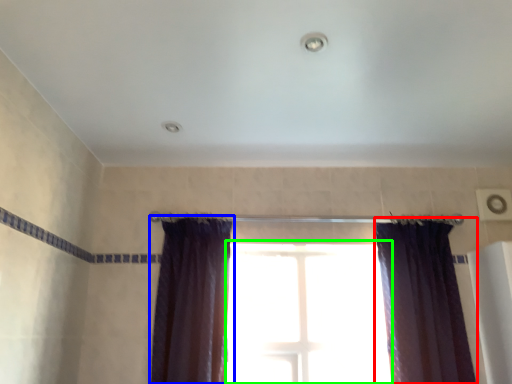
Question: Which object is positioned farthest from curtain (highlighted by a red box)? Select from curtain (highlighted by a blue box) and window (highlighted by a green box).

Choices:
 (A) curtain
 (B) window

Answer: (A)